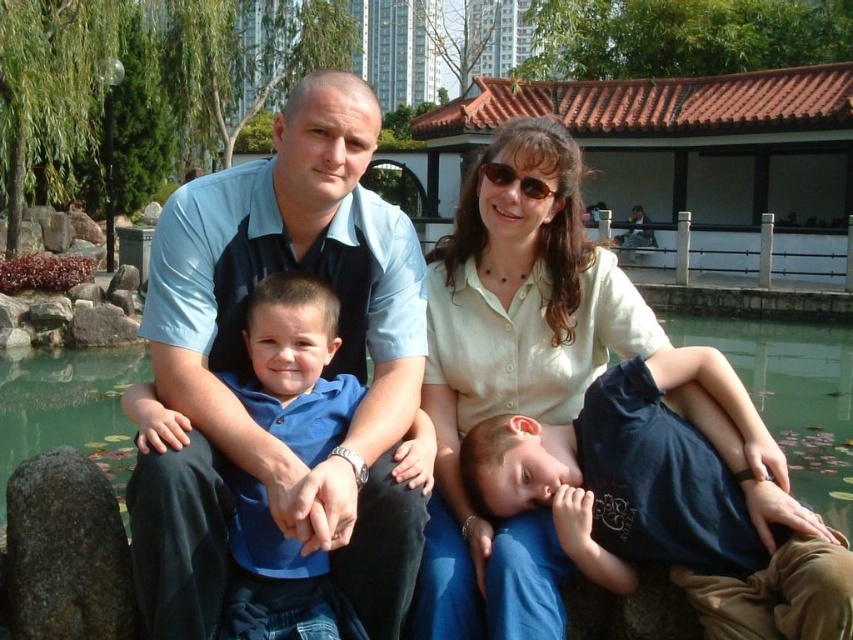
The image size is (853, 640). What do you see at coordinates (641, 474) in the screenshot?
I see `dark blue cotton shirt at lower right` at bounding box center [641, 474].

Measure the distance between point (x=693, y=476) and camera.

Point (x=693, y=476) and camera are 12.40 meters apart.

Who is more distant from viewer, (635, 522) or (102, 396)?

Point (102, 396)

Identify the location of dark blue cotton shirt at lower right. This screenshot has height=640, width=853. (641, 474).

Does blue shirt at center appear over dark blue cotton shirt at lower right?

Yes, blue shirt at center is above dark blue cotton shirt at lower right.

Does point (360, 561) lie in front of point (578, 556)?

No, (360, 561) is behind (578, 556).

You are a GUI agent. You are given a task and a screenshot of the screen. Output one action in this format:
    pyautogui.click(x=<x>, y=<y>)
    Task: Click on the blue shirt at center
    This screenshot has width=853, height=640.
    Given the screenshot: What is the action you would take?
    pyautogui.click(x=251, y=372)

How far apart are blue shirt at center and gray rough stone at lower left?

blue shirt at center and gray rough stone at lower left are 2.45 meters apart.

Locate an element on the screen. The image size is (853, 640). blue shirt at center is located at coordinates (251, 372).